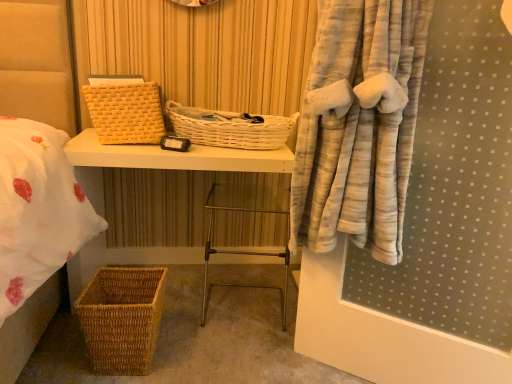
You are a GUI agent. You are given a task and a screenshot of the screen. Output one action in this format:
    pyautogui.click(x=<x>, y=<y>)
    Task: Click on the free region on the left part of woven brown basket at lower left, placed as the first basket when sorted from bottom to top
    The height and width of the screenshot is (384, 512).
    Given the screenshot: What is the action you would take?
    pyautogui.click(x=57, y=353)